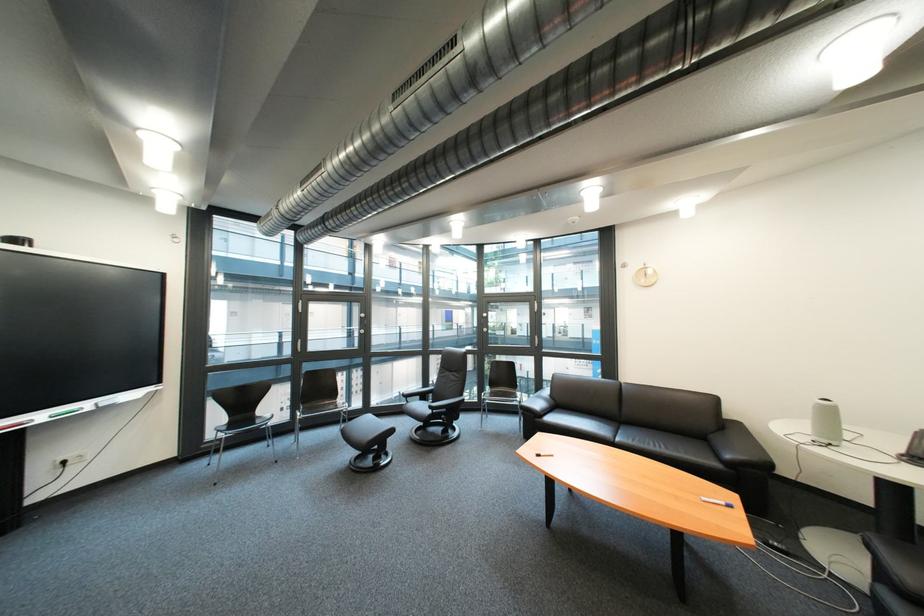
Find the location of `silver window handle`. silver window handle is located at coordinates (362, 323).